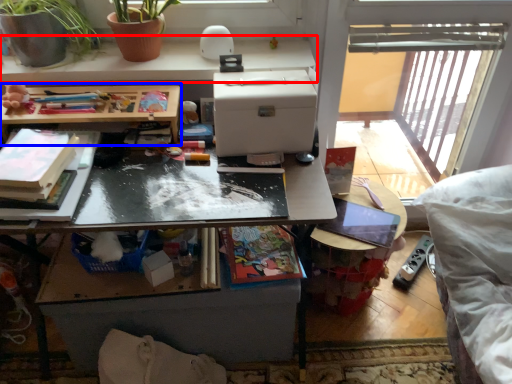
Question: Which object is closer to the camera taking this photo, desk (highlighted by a red box) or table (highlighted by a blue box)?

Choices:
 (A) desk
 (B) table

Answer: (B)